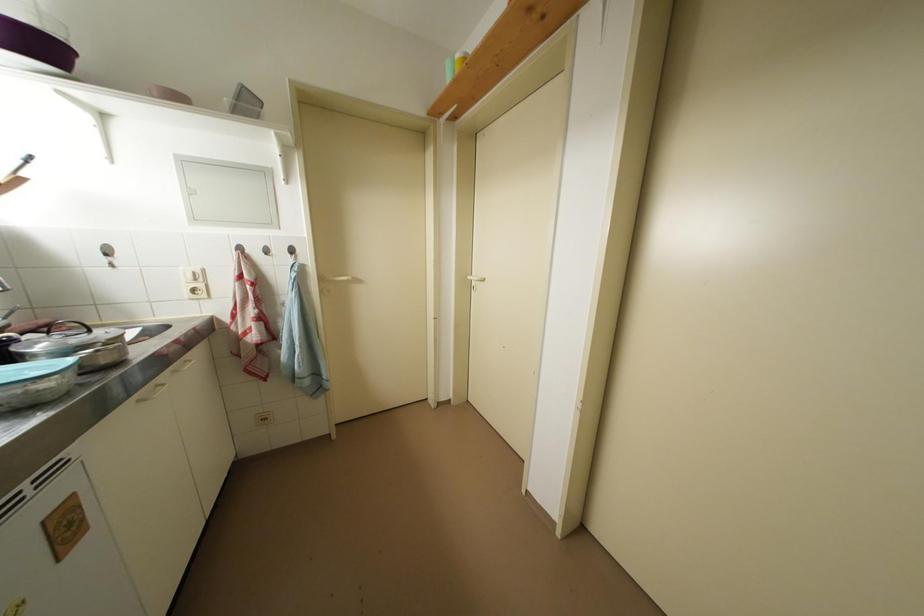
Image resolution: width=924 pixels, height=616 pixels. Describe the element at coordinates (263, 418) in the screenshot. I see `the power outlet` at that location.